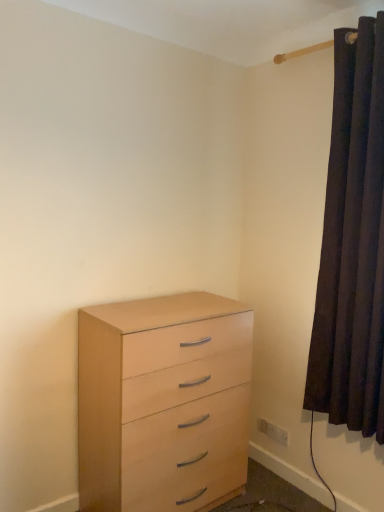
Question: In the image, is light wood chest of drawers at lower left positioned in front of or behind dark velvet curtain at right?

Choices:
 (A) behind
 (B) front

Answer: (A)

Question: Which is correct: light wood chest of drawers at lower left is inside dark velvet curtain at right, or outside of it?

Choices:
 (A) inside
 (B) outside

Answer: (B)

Question: Which object is positioned farthest from the dark velvet curtain at right?

Choices:
 (A) light wood chest of drawers at lower left
 (B) white plastic electric outlet at lower right

Answer: (B)

Question: Which is farther from the light wood chest of drawers at lower left?

Choices:
 (A) white plastic electric outlet at lower right
 (B) dark velvet curtain at right

Answer: (A)